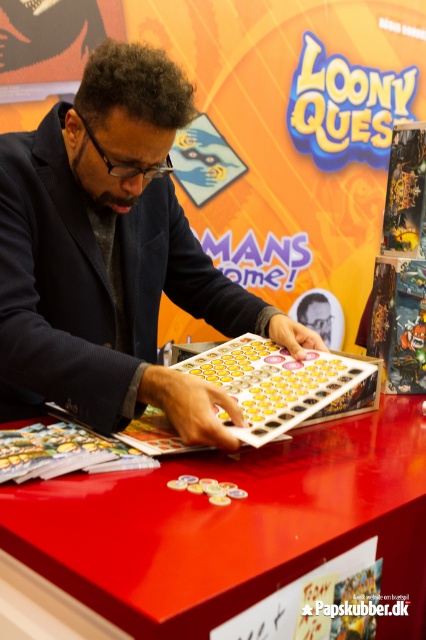
You are a photographer at the event and need to position a light source to the left of the matte black suit at center and the shiny plastic board game at center. Which object should you place the light closer to to ensure both are well lit?

The shiny plastic board game at center requires more light to reduce glare, so place the light closer to it to balance illumination between both objects.

You are a photographer at the event and want to take a photo of the matte black suit at center and the shiny plastic board game at center. Which object will appear larger in the photo?

The matte black suit at center will appear larger in the photo because it is much taller than the shiny plastic board game at center.

You are a photographer at the event and need to capture a clear shot of the shiny plastic board game at center without the matte black suit at center blocking it. How can you adjust your position or angle to ensure the board game is fully visible?

The matte black suit at center is positioned over the shiny plastic board game at center. To capture the board game without obstruction, move your camera position lower or angle it downward so the suit is no longer covering the game.